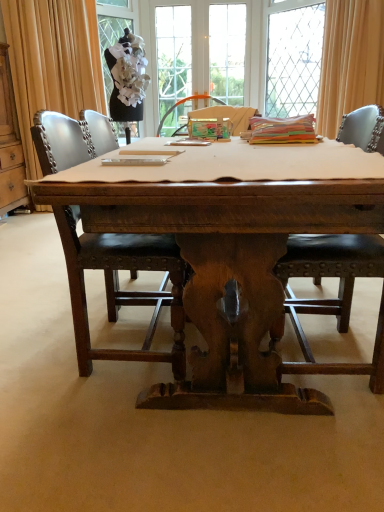
The width and height of the screenshot is (384, 512). Describe the element at coordinates (232, 261) in the screenshot. I see `wooden desk at center` at that location.

At what (x,y) coordinates should I click in order to perform the action: click on beige fabric curtain at upper left, which is the 1th curtain in left-to-right order. Please return your answer as a coordinate pair (x, y). The width and height of the screenshot is (384, 512). Looking at the image, I should click on (52, 62).

The height and width of the screenshot is (512, 384). What are the coordinates of `clear glass window at upper center, arranged as the third window when viewed from the left` in the screenshot? It's located at (293, 56).

Is brown leather chair at center, acting as the first chair starting from the left, situated inside wooden cabinet at left or outside?

brown leather chair at center, acting as the first chair starting from the left, is not enclosed by wooden cabinet at left.

Is wooden cabinet at left at the back of brown leather chair at center, acting as the first chair starting from the left?

brown leather chair at center, acting as the first chair starting from the left, does not have its back to wooden cabinet at left.

Considering the positions of objects brown leather chair at center, acting as the first chair starting from the left, and wooden cabinet at left in the image provided, who is more to the left, brown leather chair at center, acting as the first chair starting from the left, or wooden cabinet at left?

Positioned to the left is wooden cabinet at left.

Looking at this image, from the image's perspective, which is above, brown leather chair at center, acting as the first chair starting from the left, or wooden cabinet at left?

From the image's view, wooden cabinet at left is above.

Does beige fabric curtain at upper right, which is the 2th curtain from left to right, appear on the left side of wooden desk at center?

Incorrect, beige fabric curtain at upper right, which is the 2th curtain from left to right, is not on the left side of wooden desk at center.

Between beige fabric curtain at upper right, which is the 2th curtain from left to right, and wooden desk at center, which one has less height?

Standing shorter between the two is wooden desk at center.

Locate an element on the screen. Image resolution: width=384 pixels, height=512 pixels. desk directly beneath the beige fabric curtain at upper right, which is the 2th curtain from left to right (from a real-world perspective) is located at coordinates (232, 261).

Considering the positions of objects beige fabric curtain at upper right, which is the 2th curtain from left to right, and wooden desk at center in the image provided, who is behind, beige fabric curtain at upper right, which is the 2th curtain from left to right, or wooden desk at center?

beige fabric curtain at upper right, which is the 2th curtain from left to right, is further from the camera.

Are brown leather chair at center, marked as the 2th chair in a right-to-left arrangement, and clear glass window at upper center, which ranks as the first window in right-to-left order, located far from each other?

Yes, brown leather chair at center, marked as the 2th chair in a right-to-left arrangement, is far from clear glass window at upper center, which ranks as the first window in right-to-left order.

Is brown leather chair at center, acting as the first chair starting from the left, positioned beyond the bounds of clear glass window at upper center, which ranks as the first window in right-to-left order?

Yes, brown leather chair at center, acting as the first chair starting from the left, is not within clear glass window at upper center, which ranks as the first window in right-to-left order.

Does brown leather chair at center, acting as the first chair starting from the left, turn towards clear glass window at upper center, arranged as the third window when viewed from the left?

No, brown leather chair at center, acting as the first chair starting from the left, is not facing towards clear glass window at upper center, arranged as the third window when viewed from the left.

From the image's perspective, is beige fabric curtain at upper left, which is the 1th curtain in left-to-right order, located above clear glass window at upper center, which ranks as the first window in right-to-left order?

No, from the image's perspective, beige fabric curtain at upper left, which is the 1th curtain in left-to-right order, is not on top of clear glass window at upper center, which ranks as the first window in right-to-left order.

Is point (84, 22) more distant than point (301, 113)?

No, it is not.

Considering the relative sizes of beige fabric curtain at upper left, which is the 1th curtain in left-to-right order, and clear glass window at upper center, which ranks as the first window in right-to-left order, in the image provided, is beige fabric curtain at upper left, which is the 1th curtain in left-to-right order, smaller than clear glass window at upper center, which ranks as the first window in right-to-left order,?

Incorrect, beige fabric curtain at upper left, which is the 1th curtain in left-to-right order, is not smaller in size than clear glass window at upper center, which ranks as the first window in right-to-left order.

How many degrees apart are the facing directions of beige fabric curtain at upper left, which is the 1th curtain in left-to-right order, and clear glass window at upper center, arranged as the third window when viewed from the left?

There is a 87.2-degree angle between the facing directions of beige fabric curtain at upper left, which is the 1th curtain in left-to-right order, and clear glass window at upper center, arranged as the third window when viewed from the left.

Is black leather chair at center, which ranks as the 1th chair in right-to-left order, not near beige fabric curtain at upper left, which appears as the second curtain when viewed from the right?

black leather chair at center, which ranks as the 1th chair in right-to-left order, is far away from beige fabric curtain at upper left, which appears as the second curtain when viewed from the right.

Which of these two, black leather chair at center, which ranks as the 1th chair in right-to-left order, or beige fabric curtain at upper left, which appears as the second curtain when viewed from the right, is smaller?

black leather chair at center, which ranks as the 1th chair in right-to-left order.

How many degrees apart are the facing directions of black leather chair at center, which ranks as the 1th chair in right-to-left order, and beige fabric curtain at upper left, which appears as the second curtain when viewed from the right?

The angular difference between black leather chair at center, which ranks as the 1th chair in right-to-left order, and beige fabric curtain at upper left, which appears as the second curtain when viewed from the right, is 131 degrees.

Which is more to the right, black leather chair at center, which ranks as the 1th chair in right-to-left order, or beige fabric curtain at upper left, which is the 1th curtain in left-to-right order?

black leather chair at center, which ranks as the 1th chair in right-to-left order, is more to the right.

Is wooden cabinet at left oriented towards beige fabric curtain at upper right, which is the 2th curtain from left to right?

Yes, wooden cabinet at left is facing beige fabric curtain at upper right, which is the 2th curtain from left to right.

Looking at the image, does wooden cabinet at left seem bigger or smaller compared to beige fabric curtain at upper right, which is the 2th curtain from left to right?

Clearly, wooden cabinet at left is larger in size than beige fabric curtain at upper right, which is the 2th curtain from left to right.

Considering their positions, is wooden cabinet at left located in front of or behind beige fabric curtain at upper right, arranged as the first curtain when viewed from the right?

wooden cabinet at left is positioned closer to the viewer than beige fabric curtain at upper right, arranged as the first curtain when viewed from the right.

Considering the positions of objects wooden cabinet at left and beige fabric curtain at upper right, arranged as the first curtain when viewed from the right, in the image provided, who is more to the right, wooden cabinet at left or beige fabric curtain at upper right, arranged as the first curtain when viewed from the right,?

beige fabric curtain at upper right, arranged as the first curtain when viewed from the right.

Considering the sizes of black fabric mannequin at upper left, the third window in the right-to-left sequence, and beige fabric curtain at upper left, which is the 1th curtain in left-to-right order, in the image, is black fabric mannequin at upper left, the third window in the right-to-left sequence, wider or thinner than beige fabric curtain at upper left, which is the 1th curtain in left-to-right order,?

black fabric mannequin at upper left, the third window in the right-to-left sequence, is wider than beige fabric curtain at upper left, which is the 1th curtain in left-to-right order.

Is black fabric mannequin at upper left, the third window in the right-to-left sequence, beside beige fabric curtain at upper left, which appears as the second curtain when viewed from the right?

No, black fabric mannequin at upper left, the third window in the right-to-left sequence, is not beside beige fabric curtain at upper left, which appears as the second curtain when viewed from the right.

Choose the correct answer: Is black fabric mannequin at upper left, the third window in the right-to-left sequence, inside beige fabric curtain at upper left, which appears as the second curtain when viewed from the right, or outside it?

black fabric mannequin at upper left, the third window in the right-to-left sequence, is located beyond the bounds of beige fabric curtain at upper left, which appears as the second curtain when viewed from the right.

How many degrees apart are the facing directions of black fabric mannequin at upper left, the third window in the right-to-left sequence, and beige fabric curtain at upper left, which is the 1th curtain in left-to-right order?

15.3 degrees.

I want to click on cabinetry on the left of brown leather chair at center, acting as the first chair starting from the left, so click(x=10, y=144).

What are the coordinates of `the 2nd curtain above the wooden desk at center (from the image's perspective)` in the screenshot? It's located at (350, 61).

Estimate the real-world distances between objects in this image. Which object is closer to beige fabric curtain at upper right, arranged as the first curtain when viewed from the right, beige fabric curtain at upper left, which appears as the second curtain when viewed from the right, or clear glass window at upper center, arranged as the third window when viewed from the left?

Based on the image, clear glass window at upper center, arranged as the third window when viewed from the left, appears to be nearer to beige fabric curtain at upper right, arranged as the first curtain when viewed from the right.

Looking at the image, which one is located further to clear glass window at upper center, which ranks as the first window in right-to-left order, black leather chair at center, the second chair in the left-to-right sequence, or wooden cabinet at left?

Among the two, black leather chair at center, the second chair in the left-to-right sequence, is located further to clear glass window at upper center, which ranks as the first window in right-to-left order.

Estimate the real-world distances between objects in this image. Which object is closer to clear glass window at upper center, arranged as the third window when viewed from the left, white matte tablecloth at center or wooden desk at center?

wooden desk at center.

Which object lies further to the anchor point beige fabric curtain at upper right, which is the 2th curtain from left to right, wooden cabinet at left or brown leather chair at center, acting as the first chair starting from the left?

The object further to beige fabric curtain at upper right, which is the 2th curtain from left to right, is wooden cabinet at left.

Considering their positions, is black leather chair at center, the second chair in the left-to-right sequence, positioned further to beige fabric curtain at upper right, arranged as the first curtain when viewed from the right, than black fabric mannequin at upper left, the third window in the right-to-left sequence?

Based on the image, black leather chair at center, the second chair in the left-to-right sequence, appears to be further to beige fabric curtain at upper right, arranged as the first curtain when viewed from the right.

When comparing their distances from wooden cabinet at left, does black leather chair at center, which ranks as the 1th chair in right-to-left order, or brown leather chair at center, acting as the first chair starting from the left, seem closer?

Among the two, brown leather chair at center, acting as the first chair starting from the left, is located nearer to wooden cabinet at left.

Which object lies further to the anchor point beige fabric curtain at upper left, which appears as the second curtain when viewed from the right, black fabric mannequin at upper left, the 1th window positioned from the left, or clear glass window at upper center, which is the second window in right-to-left order?

The object further to beige fabric curtain at upper left, which appears as the second curtain when viewed from the right, is clear glass window at upper center, which is the second window in right-to-left order.

Considering their positions, is beige fabric curtain at upper right, which is the 2th curtain from left to right, positioned further to wooden desk at center than clear glass window at upper center, arranged as the third window when viewed from the left?

clear glass window at upper center, arranged as the third window when viewed from the left, lies further to wooden desk at center than the other object.

Image resolution: width=384 pixels, height=512 pixels. Find the location of `window positioned between white matte tablecloth at center and clear glass window at upper center, which ranks as the first window in right-to-left order, from near to far`. window positioned between white matte tablecloth at center and clear glass window at upper center, which ranks as the first window in right-to-left order, from near to far is located at coordinates (112, 31).

Identify the location of window positioned between wooden desk at center and clear glass window at upper center, arranged as the third window when viewed from the left, from near to far. Image resolution: width=384 pixels, height=512 pixels. (112, 31).

Where is `tablecloth between wooden desk at center and beige fabric curtain at upper right, which is the 2th curtain from left to right, in the front-back direction`? tablecloth between wooden desk at center and beige fabric curtain at upper right, which is the 2th curtain from left to right, in the front-back direction is located at coordinates (230, 192).

This screenshot has width=384, height=512. Find the location of `curtain between wooden cabinet at left and clear glass window at upper center, which is the second window in right-to-left order, from left to right`. curtain between wooden cabinet at left and clear glass window at upper center, which is the second window in right-to-left order, from left to right is located at coordinates (52, 62).